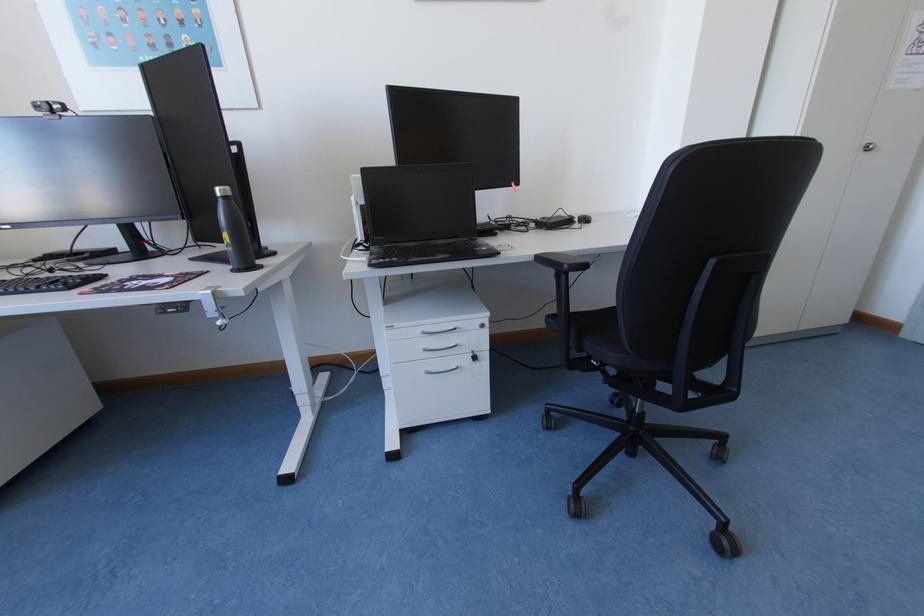
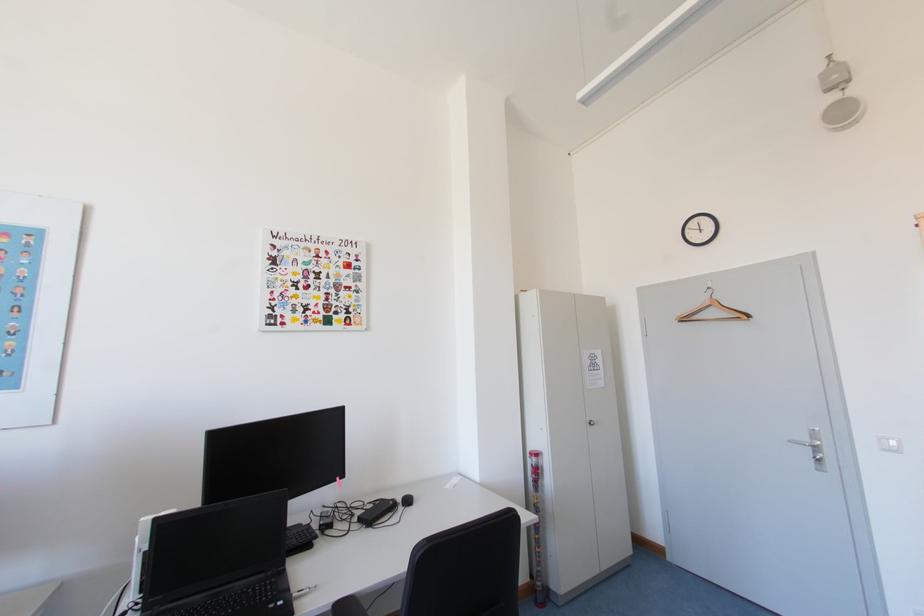
First-person continuous shooting, in which direction is the camera rotating?

The camera's rotation is toward right-up.